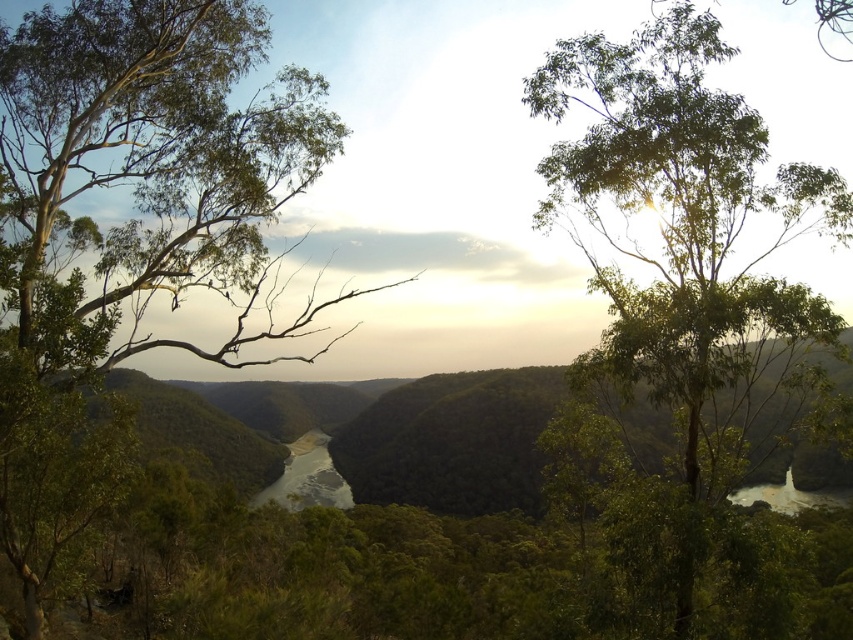
You are standing at the center of the scene and want to take a photo of the green leafy tree at left. In which direction should you point your camera to capture it?

The green leafy tree at left is located at point 0.273 on the x and 0.174 on the y coordinates. Since you are at the center, you need to point your camera to the left and slightly downward to capture the tree.

You are an explorer in this landscape. You want to take a photo of the green smooth river at center without the green leafy tree at upper center blocking the view. Is there a way to position yourself so that the tree is not in front of the river?

The green leafy tree at upper center is in front of the green smooth river at center, so you cannot position yourself to avoid the tree blocking the river in this scene.

Based on the photo, you are standing at the center of the image and want to take a photo of the green leafy tree at left. In which direction should you point your camera to capture it?

The green leafy tree at left is located at point coordinates of 0.273 on the x axis and 0.174 on the y axis. Since you are at the center of the image, you should point your camera to the left and slightly downward to capture the green leafy tree at left.